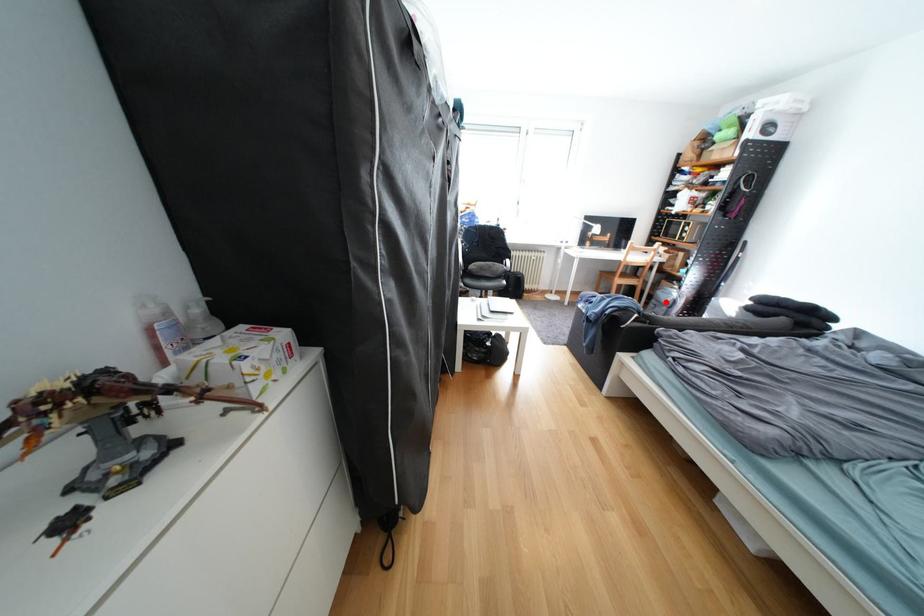
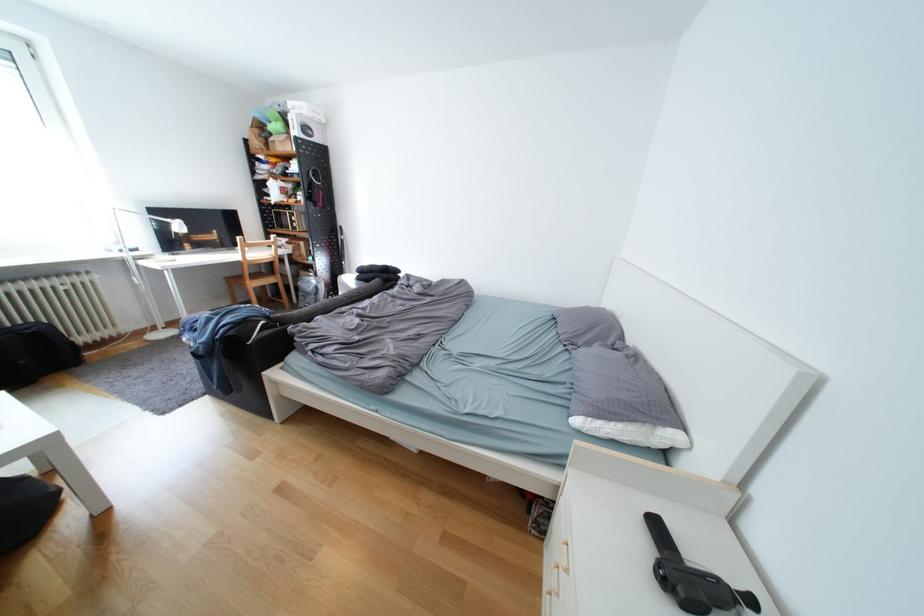
The point at the highlighted location is marked in the first image. Where is the corresponding point in the second image?

(313, 294)